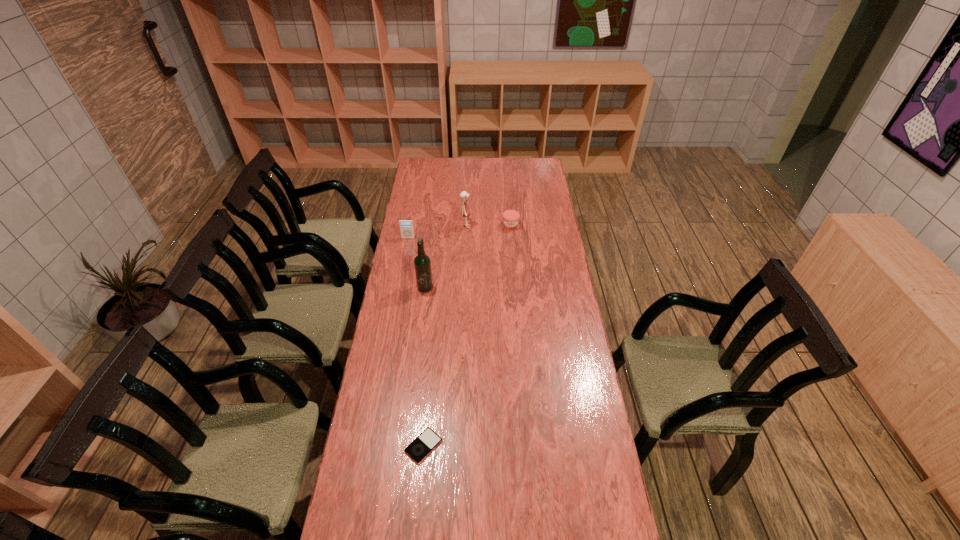
What are the coordinates of `empty location between the rightmost object and the beer bottle` in the screenshot? It's located at (468, 256).

In order to click on the second closest object to the fourth tallest object in this screenshot , I will do `click(406, 225)`.

The height and width of the screenshot is (540, 960). In order to click on object that stands as the second closest to the beer bottle in this screenshot , I will do `click(465, 211)`.

Find the location of `free location that satisfies the following two spatial constraints: 1. on the front label of the second shortest object; 2. on the front-facing side of the doll`. free location that satisfies the following two spatial constraints: 1. on the front label of the second shortest object; 2. on the front-facing side of the doll is located at coordinates (511, 227).

Where is `free location that satisfies the following two spatial constraints: 1. on the front-facing side of the right iPod; 2. on the left side of the taller iPod`? This screenshot has width=960, height=540. free location that satisfies the following two spatial constraints: 1. on the front-facing side of the right iPod; 2. on the left side of the taller iPod is located at coordinates (370, 446).